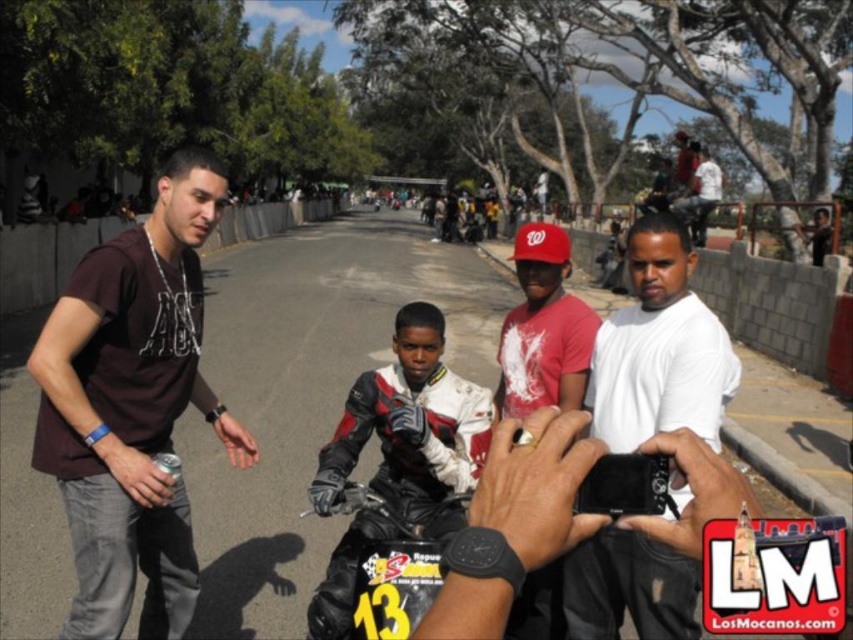
Question: Where is white matte shirt at center located in relation to black leather motorcycle at center in the image?

Choices:
 (A) left
 (B) right

Answer: (B)

Question: Which object appears farthest from the camera in this image?

Choices:
 (A) black leather motorcycle at center
 (B) leather jacket at center
 (C) dark brown t-shirt at left

Answer: (B)

Question: Does dark brown t-shirt at left have a greater width compared to black leather motorcycle at center?

Choices:
 (A) no
 (B) yes

Answer: (B)

Question: Which point is closer to the camera?

Choices:
 (A) (70, 524)
 (B) (364, 612)
 (C) (685, 355)
 (D) (413, 520)

Answer: (B)

Question: Is dark brown t-shirt at left bigger than black leather motorcycle at center?

Choices:
 (A) yes
 (B) no

Answer: (A)

Question: Which point is closer to the camera?

Choices:
 (A) white matte shirt at center
 (B) dark brown t-shirt at left
 (C) leather jacket at center
 (D) black leather motorcycle at center

Answer: (A)